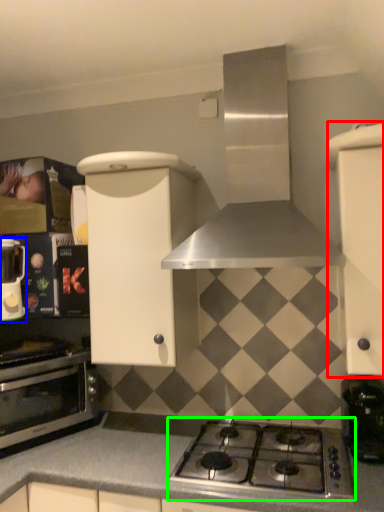
Question: Based on their relative distances, which object is farther from cabinetry (highlighted by a red box)? Choose from kitchen appliance (highlighted by a blue box) and gas stove (highlighted by a green box).

Choices:
 (A) kitchen appliance
 (B) gas stove

Answer: (A)